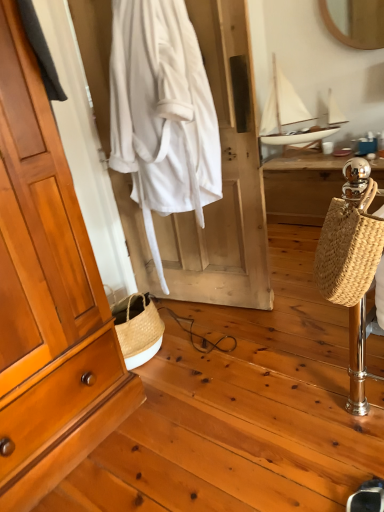
What do you see at coordinates (293, 114) in the screenshot? The height and width of the screenshot is (512, 384). I see `white matte sailboat at upper right` at bounding box center [293, 114].

This screenshot has height=512, width=384. What do you see at coordinates (162, 113) in the screenshot? I see `white cotton robe at center` at bounding box center [162, 113].

What do you see at coordinates (301, 186) in the screenshot? Image resolution: width=384 pixels, height=512 pixels. I see `woven wood desk at right` at bounding box center [301, 186].

Where is `woven wood desk at right`? woven wood desk at right is located at coordinates (301, 186).

This screenshot has width=384, height=512. What do you see at coordinates (367, 497) in the screenshot? I see `black suede shoe at lower right` at bounding box center [367, 497].

Locate an element on the screen. The image size is (384, 512). black suede shoe at lower right is located at coordinates (x=367, y=497).

The image size is (384, 512). In order to click on white matte sailboat at upper right in this screenshot , I will do `click(293, 114)`.

Is woven straw bag at right bigger or smaller than white matte coffee cup at center?

Clearly, woven straw bag at right is larger in size than white matte coffee cup at center.

Is the surface of woven straw bag at right in direct contact with white matte coffee cup at center?

No.

From the image's perspective, which one is positioned lower, woven straw bag at right or white matte coffee cup at center?

woven straw bag at right appears lower in the image.

Can you confirm if woven straw bag at right is thinner than white matte coffee cup at center?

No, woven straw bag at right is not thinner than white matte coffee cup at center.

Is black suede shoe at lower right in contact with white matte sailboat at upper right?

black suede shoe at lower right and white matte sailboat at upper right are not in contact.

From a real-world perspective, is black suede shoe at lower right on top of white matte sailboat at upper right?

No.

Can you confirm if black suede shoe at lower right is positioned to the left of white matte sailboat at upper right?

Yes, black suede shoe at lower right is to the left of white matte sailboat at upper right.

Is white matte sailboat at upper right at the back of black suede shoe at lower right?

black suede shoe at lower right does not have its back to white matte sailboat at upper right.

Based on the photo, is woven straw bag at right smaller than matte wood cabinet at left?

Yes, woven straw bag at right is smaller than matte wood cabinet at left.

From a real-world perspective, is woven straw bag at right physically located above or below matte wood cabinet at left?

woven straw bag at right is below matte wood cabinet at left.

Is woven straw bag at right wider or thinner than matte wood cabinet at left?

In the image, woven straw bag at right appears to be wider than matte wood cabinet at left.

Does point (372, 262) appear closer or farther from the camera than point (91, 393)?

Point (372, 262) is closer to the camera than point (91, 393).

Consider the image. From the image's perspective, which object appears higher, white matte sailboat at upper right or white matte coffee cup at center?

white matte sailboat at upper right, from the image's perspective.

Is white matte coffee cup at center inside white matte sailboat at upper right?

Yes, white matte sailboat at upper right is surrounding white matte coffee cup at center.

Which is more to the left, white matte sailboat at upper right or white matte coffee cup at center?

From the viewer's perspective, white matte sailboat at upper right appears more on the left side.

Does point (347, 266) come farther from viewer compared to point (334, 132)?

No, it is in front of (334, 132).

From the image's perspective, would you say woven straw bag at right is shown under white matte sailboat at upper right?

Yes, from the image's perspective, woven straw bag at right is beneath white matte sailboat at upper right.

Is woven straw bag at right taller or shorter than white matte sailboat at upper right?

woven straw bag at right is shorter than white matte sailboat at upper right.

Is black suede shoe at lower right wider or thinner than white matte coffee cup at center?

In the image, black suede shoe at lower right appears to be wider than white matte coffee cup at center.

Is black suede shoe at lower right looking in the opposite direction of white matte coffee cup at center?

black suede shoe at lower right is not turned away from white matte coffee cup at center.

Consider the image. Is black suede shoe at lower right to the left or to the right of white matte coffee cup at center in the image?

In the image, black suede shoe at lower right appears on the left side of white matte coffee cup at center.

Is black suede shoe at lower right oriented away from matte wood cabinet at left?

No, black suede shoe at lower right's orientation is not away from matte wood cabinet at left.

Can you confirm if black suede shoe at lower right is positioned to the left of matte wood cabinet at left?

No, black suede shoe at lower right is not to the left of matte wood cabinet at left.

Considering their positions, is black suede shoe at lower right located in front of or behind matte wood cabinet at left?

In the image, black suede shoe at lower right appears in front of matte wood cabinet at left.

At what (x,y) coordinates should I click in order to perform the action: click on handbag on the left of white matte coffee cup at center. Please return your answer as a coordinate pair (x, y). Looking at the image, I should click on (349, 248).

At what (x,y) coordinates should I click in order to perform the action: click on sailboat located behind the black suede shoe at lower right. Please return your answer as a coordinate pair (x, y). The width and height of the screenshot is (384, 512). Looking at the image, I should click on (293, 114).

Estimate the real-world distances between objects in this image. Which object is closer to white matte sailboat at upper right, woven wood desk at right or white matte coffee cup at center?

Among the two, woven wood desk at right is located nearer to white matte sailboat at upper right.

Considering their positions, is matte wood cabinet at left positioned further to white matte sailboat at upper right than black suede shoe at lower right?

black suede shoe at lower right lies further to white matte sailboat at upper right than the other object.

Considering their positions, is white cotton robe at center positioned further to matte wood cabinet at left than woven wood desk at right?

Based on the image, woven wood desk at right appears to be further to matte wood cabinet at left.

When comparing their distances from white matte coffee cup at center, does white cotton robe at center or matte wood cabinet at left seem closer?

white cotton robe at center is closer to white matte coffee cup at center.

Which object lies further to the anchor point white cotton robe at center, woven straw bag at right or matte wood cabinet at left?

Among the two, woven straw bag at right is located further to white cotton robe at center.

Which object lies nearer to the anchor point white matte sailboat at upper right, white cotton robe at center or woven wood desk at right?

Based on the image, woven wood desk at right appears to be nearer to white matte sailboat at upper right.

Which object lies further to the anchor point woven wood desk at right, white matte sailboat at upper right or matte wood cabinet at left?

Based on the image, matte wood cabinet at left appears to be further to woven wood desk at right.

Which object lies further to the anchor point black suede shoe at lower right, white matte coffee cup at center or white cotton robe at center?

white matte coffee cup at center lies further to black suede shoe at lower right than the other object.

You are a GUI agent. You are given a task and a screenshot of the screen. Output one action in this format:
    pyautogui.click(x=<x>, y=<y>)
    Task: Click on the clothing between matte wood cabinet at left and white matte sailboat at upper right along the z-axis
    The width and height of the screenshot is (384, 512).
    Given the screenshot: What is the action you would take?
    pyautogui.click(x=162, y=113)

The width and height of the screenshot is (384, 512). I want to click on handbag between white cotton robe at center and black suede shoe at lower right in the vertical direction, so click(349, 248).

Image resolution: width=384 pixels, height=512 pixels. I want to click on desk between white matte sailboat at upper right and black suede shoe at lower right in the vertical direction, so click(301, 186).

Find the location of a particular element. The width and height of the screenshot is (384, 512). clothing positioned between woven straw bag at right and white matte sailboat at upper right from near to far is located at coordinates (162, 113).